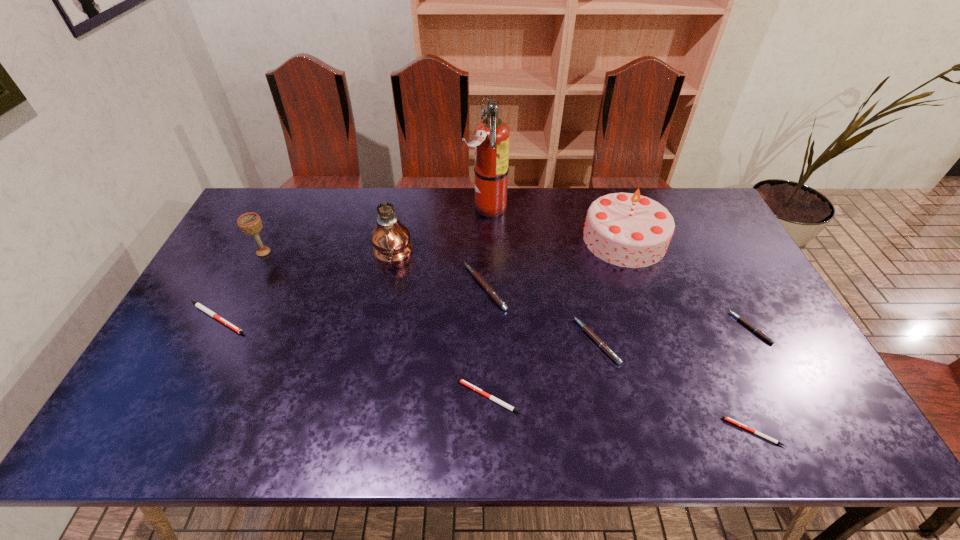
This screenshot has width=960, height=540. Identify the location of vacant area situated at the nib of the second pink pen from right to left. (483, 341).

Locate an element on the screen. vacant space located on the clicker of the leftmost pen is located at coordinates (301, 318).

Image resolution: width=960 pixels, height=540 pixels. Identify the location of free point located at the nib of the rightmost object. [x=648, y=328].

I want to click on free space located at the nib of the rightmost object, so click(626, 328).

Find the location of a particular element. This screenshot has width=960, height=540. blank space located at the nib of the rightmost object is located at coordinates point(670,328).

Identify the location of free space located on the clicker of the fifth farthest pen. (348, 397).

What are the coordinates of `vacant space located on the clicker of the fifth farthest pen` in the screenshot? It's located at 299,397.

Where is `free location located on the clicker of the fifth farthest pen`? This screenshot has height=540, width=960. free location located on the clicker of the fifth farthest pen is located at coordinates (357, 397).

Where is `free space located on the clicker of the second pen from right to left`? free space located on the clicker of the second pen from right to left is located at coordinates (701, 432).

You are a GUI agent. You are given a task and a screenshot of the screen. Output one action in this format:
    pyautogui.click(x=<x>, y=<y>)
    Task: Click on the vacant space located on the clicker of the second pen from right to left
    
    Given the screenshot: What is the action you would take?
    pyautogui.click(x=683, y=432)